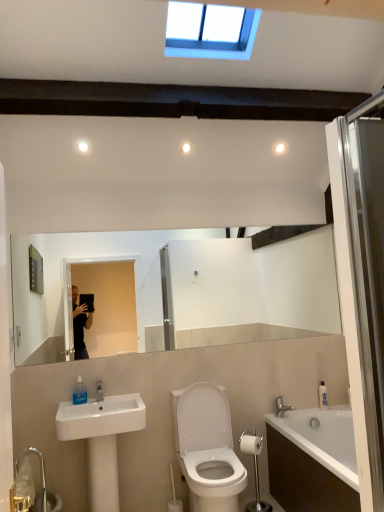
Measure the distance between white glossy sink at lower left and camera.

The depth of white glossy sink at lower left is 2.51 meters.

Describe the element at coordinates (101, 440) in the screenshot. This screenshot has width=384, height=512. I see `white glossy sink at lower left` at that location.

Describe the element at coordinates (79, 392) in the screenshot. The width and height of the screenshot is (384, 512). I see `transparent plastic soap dispenser at lower left, positioned as the second toiletry in back-to-front order` at that location.

I want to click on white plastic soap dispenser at lower right, the second toiletry when ordered from left to right, so click(x=323, y=396).

What do you see at coordinates (251, 443) in the screenshot? I see `white matte toilet paper at lower right` at bounding box center [251, 443].

Find the location of `white matte toilet paper at lower right`. white matte toilet paper at lower right is located at coordinates (251, 443).

Where is `white glossy sink at lower left`? This screenshot has height=512, width=384. white glossy sink at lower left is located at coordinates (101, 440).

Considering the sizes of white matte toilet paper at lower right and white plastic soap dispenser at lower right, which appears as the 2th toiletry when viewed from the top, in the image, is white matte toilet paper at lower right taller or shorter than white plastic soap dispenser at lower right, which appears as the 2th toiletry when viewed from the top,?

Considering their sizes, white matte toilet paper at lower right has less height than white plastic soap dispenser at lower right, which appears as the 2th toiletry when viewed from the top.

Which is more distant, (252, 432) or (321, 392)?

The point (321, 392) is farther from the camera.

From a real-world perspective, which is physically below, white matte toilet paper at lower right or white plastic soap dispenser at lower right, the first toiletry positioned from the right?

In real-world perspective, white matte toilet paper at lower right is lower.

How distant is white glossy toilet at center from white matte toilet paper at lower right?

white glossy toilet at center and white matte toilet paper at lower right are 31.79 centimeters apart.

Could you tell me if white glossy toilet at center is facing white matte toilet paper at lower right?

No, white glossy toilet at center is not aimed at white matte toilet paper at lower right.

Considering the sizes of objects white glossy toilet at center and white matte toilet paper at lower right in the image provided, who is wider, white glossy toilet at center or white matte toilet paper at lower right?

white glossy toilet at center.

From the picture: What's the angular difference between white glossy toilet at center and white matte toilet paper at lower right's facing directions?

44.1 degrees.

Is white glossy sink at lower left positioned far away from white matte toilet paper at lower right?

No, there isn't a large distance between white glossy sink at lower left and white matte toilet paper at lower right.

Considering the positions of objects white glossy sink at lower left and white matte toilet paper at lower right in the image provided, who is more to the right, white glossy sink at lower left or white matte toilet paper at lower right?

white matte toilet paper at lower right is more to the right.

Between white glossy sink at lower left and white matte toilet paper at lower right, which one has more height?

Standing taller between the two is white glossy sink at lower left.

Is white matte toilet paper at lower right inside the boundaries of white glossy toilet at center, or outside?

white matte toilet paper at lower right is not enclosed by white glossy toilet at center.

The width and height of the screenshot is (384, 512). I want to click on toilet paper above the white glossy toilet at center (from the image's perspective), so tap(251, 443).

Would you say white matte toilet paper at lower right is to the left or to the right of white glossy toilet at center in the picture?

Based on their positions, white matte toilet paper at lower right is located to the right of white glossy toilet at center.

Is white matte toilet paper at lower right facing towards white glossy toilet at center?

Yes, white matte toilet paper at lower right faces towards white glossy toilet at center.

Considering the sizes of objects transparent glass shower door at right and silver metallic faucet at lower right in the image provided, who is smaller, transparent glass shower door at right or silver metallic faucet at lower right?

With smaller size is silver metallic faucet at lower right.

How far apart are transparent glass shower door at right and silver metallic faucet at lower right?

They are 6.34 feet apart.

From the image's perspective, is transparent glass shower door at right above or below silver metallic faucet at lower right?

Based on their image positions, transparent glass shower door at right is located above silver metallic faucet at lower right.

Where is `tap on the right of transparent glass shower door at right`? The image size is (384, 512). tap on the right of transparent glass shower door at right is located at coordinates (282, 407).

From the picture: From the image's perspective, is silver metallic faucet at lower right below transparent glass shower door at right?

Yes.

Considering the positions of point (281, 400) and point (334, 196), is point (281, 400) closer or farther from the camera than point (334, 196)?

Clearly, point (281, 400) is more distant from the camera than point (334, 196).

Considering the relative sizes of silver metallic faucet at lower right and transparent glass shower door at right in the image provided, is silver metallic faucet at lower right taller than transparent glass shower door at right?

In fact, silver metallic faucet at lower right may be shorter than transparent glass shower door at right.

Is transparent glass shower door at right to the left of white glossy sink at lower left from the viewer's perspective?

No, transparent glass shower door at right is not to the left of white glossy sink at lower left.

Does point (333, 130) lie in front of point (74, 423)?

No, (333, 130) is further to viewer.

Is transparent glass shower door at right in contact with white glossy sink at lower left?

No, transparent glass shower door at right is not touching white glossy sink at lower left.

From a real-world perspective, who is located higher, transparent glass shower door at right or white glossy sink at lower left?

In real-world perspective, transparent glass shower door at right is above.

From a real-world perspective, starting from the white matte toilet paper at lower right, which toiletry is the 1st one vertically above it? Please provide its 2D coordinates.

[(323, 396)]

Where is `toilet in front of the white matte toilet paper at lower right`? The width and height of the screenshot is (384, 512). toilet in front of the white matte toilet paper at lower right is located at coordinates (207, 448).

Looking at the image, which one is located closer to white glossy bathtub at lower right, silver metallic faucet at lower right or white glossy toilet at center?

silver metallic faucet at lower right lies closer to white glossy bathtub at lower right than the other object.

Which object lies further to the anchor point white glossy sink at lower left, white glossy bathtub at lower right or white plastic soap dispenser at lower right, marked as the second toiletry in a front-to-back arrangement?

white plastic soap dispenser at lower right, marked as the second toiletry in a front-to-back arrangement, is further to white glossy sink at lower left.

Which object lies nearer to the anchor point silver metallic faucet at lower right, white matte toilet paper at lower right or white glossy sink at lower left?

white matte toilet paper at lower right is positioned closer to the anchor silver metallic faucet at lower right.

Estimate the real-world distances between objects in this image. Which object is further from white glossy toilet at center, silver metallic faucet at lower right or white glossy bathtub at lower right?

silver metallic faucet at lower right is further to white glossy toilet at center.

From the image, which object appears to be farther from white glossy sink at lower left, silver metallic faucet at lower right or transparent glass shower door at right?

transparent glass shower door at right is positioned further to the anchor white glossy sink at lower left.

From the image, which object appears to be farther from white glossy sink at lower left, white glossy bathtub at lower right or white glossy toilet at center?

The object further to white glossy sink at lower left is white glossy bathtub at lower right.

From the image, which object appears to be nearer to white glossy toilet at center, white glossy sink at lower left or transparent plastic soap dispenser at lower left, which ranks as the first toiletry in front-to-back order?

Among the two, white glossy sink at lower left is located nearer to white glossy toilet at center.

When comparing their distances from transparent glass shower door at right, does white glossy bathtub at lower right or white glossy sink at lower left seem further?

→ white glossy sink at lower left lies further to transparent glass shower door at right than the other object.

Locate an element on the screen. The height and width of the screenshot is (512, 384). toilet between blue plastic window at upper center and white glossy bathtub at lower right in the vertical direction is located at coordinates (207, 448).

The image size is (384, 512). I want to click on toilet between transparent glass shower door at right and white glossy sink at lower left along the z-axis, so click(x=207, y=448).

Where is `screen door that lies between blue plastic window at upper center and white glossy toilet at center from top to bottom`? screen door that lies between blue plastic window at upper center and white glossy toilet at center from top to bottom is located at coordinates (358, 306).

Locate an element on the screen. screen door between blue plastic window at upper center and white plastic soap dispenser at lower right, the first toiletry positioned from the bottom, in the up-down direction is located at coordinates (358, 306).